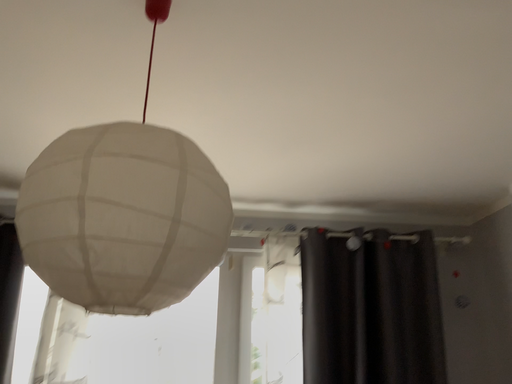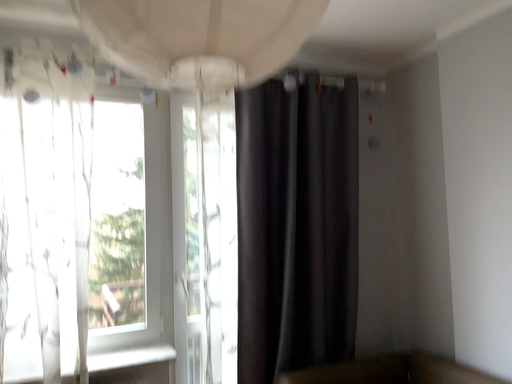
Question: How did the camera likely rotate when shooting the video?

Choices:
 (A) rotated upward
 (B) rotated downward

Answer: (B)